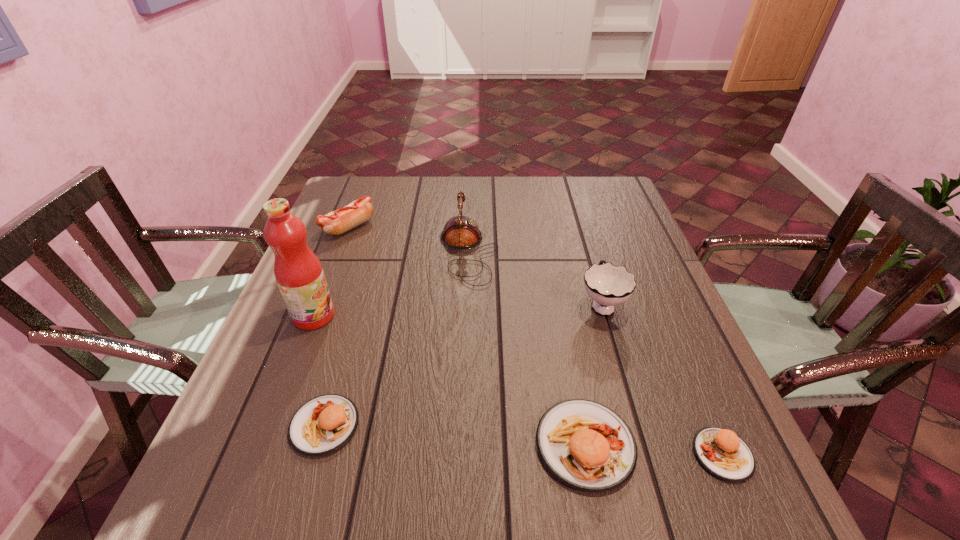
Locate an element on the screen. The width and height of the screenshot is (960, 540). the second tallest patty is located at coordinates (322, 425).

You are a GUI agent. You are given a task and a screenshot of the screen. Output one action in this format:
    pyautogui.click(x=<x>, y=<y>)
    Task: Click on the leftmost patty
    The image size is (960, 540).
    Given the screenshot: What is the action you would take?
    pyautogui.click(x=322, y=425)

Where is `the tallest patty`? This screenshot has height=540, width=960. the tallest patty is located at coordinates (586, 445).

What are the coordinates of `the rightmost object` in the screenshot? It's located at (721, 452).

Where is `the rightmost patty`? the rightmost patty is located at coordinates (721, 452).

Where is `fruit juice`? The width and height of the screenshot is (960, 540). fruit juice is located at coordinates (298, 272).

This screenshot has height=540, width=960. What are the coordinates of `sausage` in the screenshot? It's located at (341, 220).

Where is `the sixth shortest object`? the sixth shortest object is located at coordinates (461, 233).

This screenshot has height=540, width=960. Identify the location of telephone. (461, 233).

You are a GUI agent. You are given a task and a screenshot of the screen. Output one action in this format:
    pyautogui.click(x=<x>, y=<y>)
    Task: Click on the cup
    This screenshot has height=540, width=960.
    Given the screenshot: What is the action you would take?
    pyautogui.click(x=608, y=285)